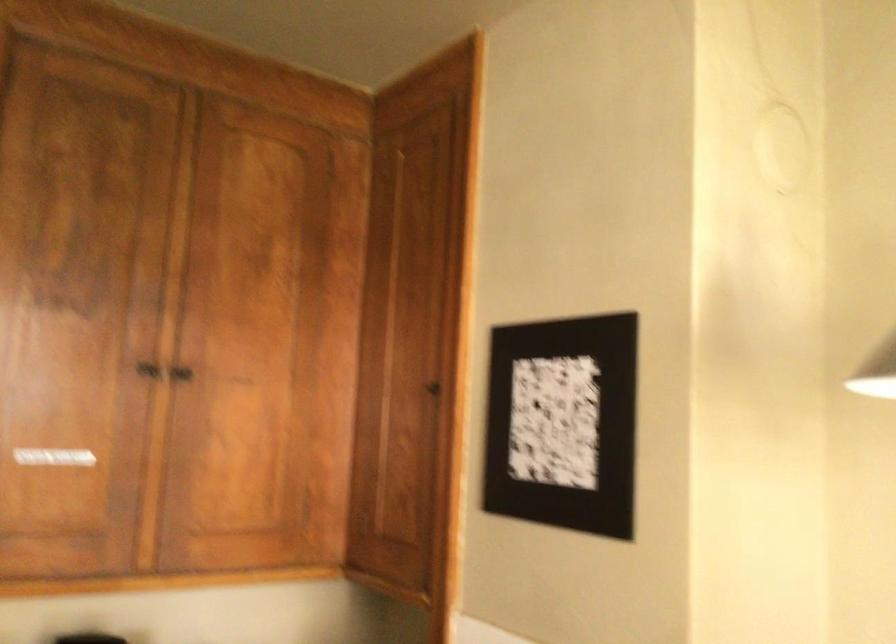
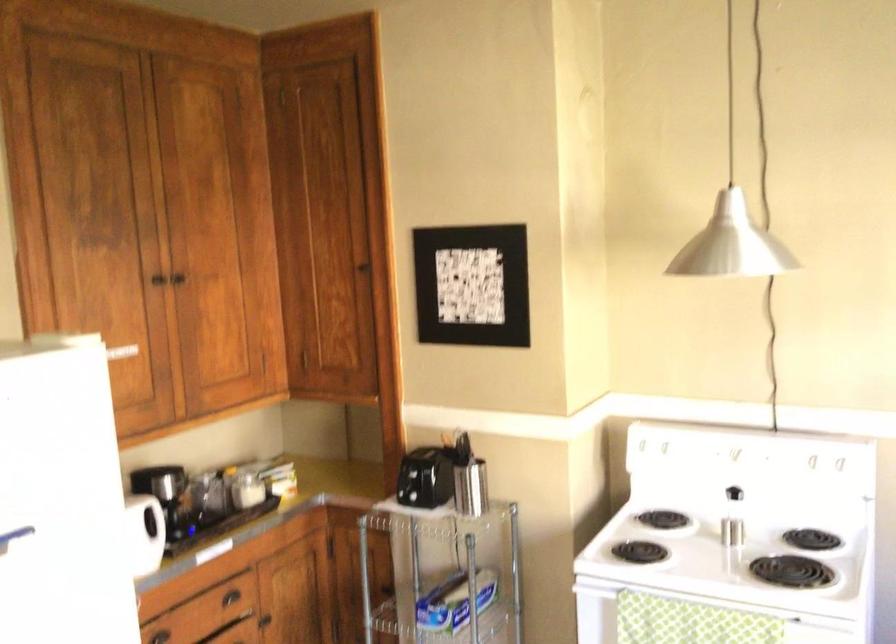
What movement of the cameraman would produce the second image?

The cameraman walked toward left, backward.